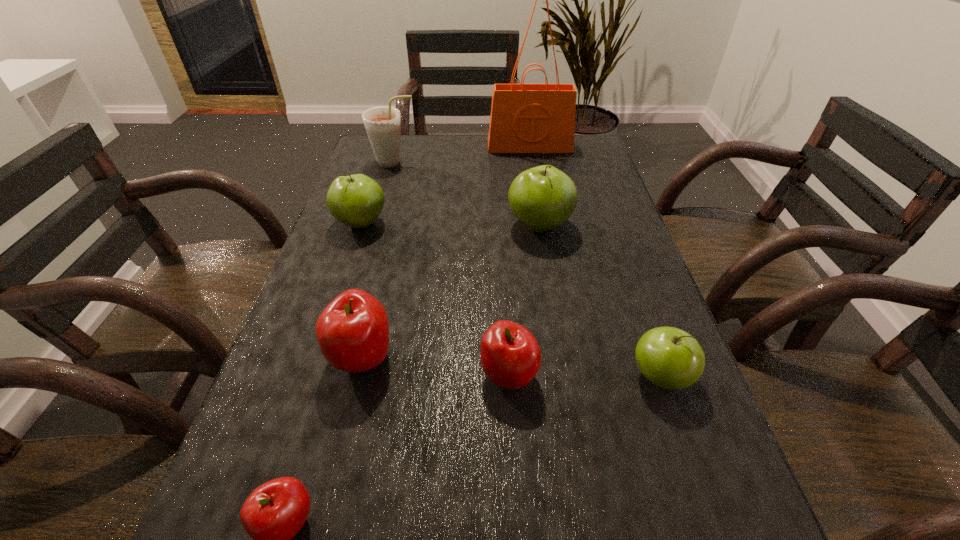
This screenshot has height=540, width=960. I want to click on tote bag located in the right edge section of the desktop, so click(x=525, y=118).

Image resolution: width=960 pixels, height=540 pixels. Identify the location of object that is positioned at the far left corner. (382, 124).

Locate an element on the screen. object that is at the far right corner is located at coordinates click(525, 118).

Locate an element on the screen. vacant space at the far edge is located at coordinates (424, 163).

You are a GUI agent. You are given a task and a screenshot of the screen. Output one action in this format:
    pyautogui.click(x=<x>, y=<y>)
    Task: Click on the vacant space at the left edge of the desktop
    The width and height of the screenshot is (960, 540).
    Given the screenshot: What is the action you would take?
    pyautogui.click(x=345, y=466)

Find the location of a particular element. free space at the right edge of the desktop is located at coordinates (563, 226).

You are a GUI agent. You are given a task and a screenshot of the screen. Output one action in this format:
    pyautogui.click(x=<x>, y=<y>)
    Task: Click on the blank area at the far left corner
    This screenshot has width=960, height=540.
    Given the screenshot: What is the action you would take?
    pyautogui.click(x=409, y=139)

You are a GUI agent. You are given a task and a screenshot of the screen. Output one action in this format:
    pyautogui.click(x=<x>, y=<y>)
    Task: Click on the free region at the far right corner
    Image resolution: width=960 pixels, height=540 pixels.
    Given the screenshot: What is the action you would take?
    pyautogui.click(x=574, y=138)

Where is `free space between the second smallest green apple and the rightmost green apple`? free space between the second smallest green apple and the rightmost green apple is located at coordinates (511, 300).

Where is `vacant area that lies between the biggest red apple and the seventh nearest object`? vacant area that lies between the biggest red apple and the seventh nearest object is located at coordinates (378, 260).